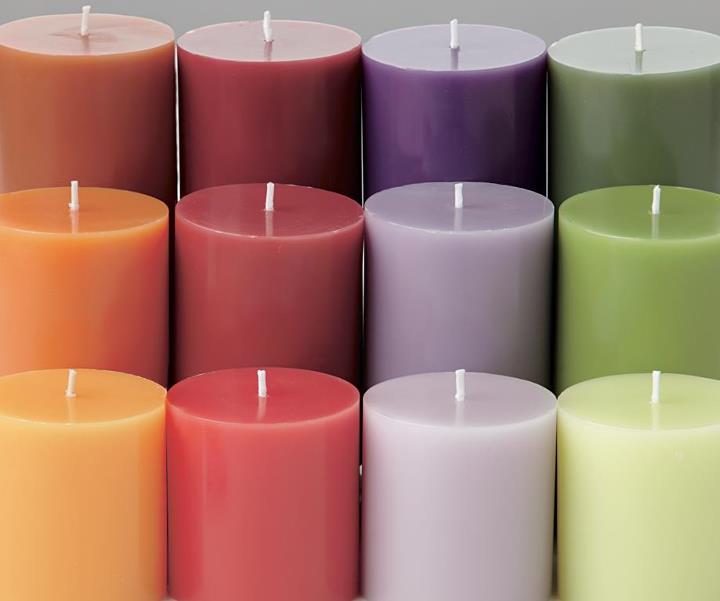
The image size is (720, 601). Identify the location of candles in top row. tap(78, 120), tap(261, 129), tap(451, 135), tap(636, 129).